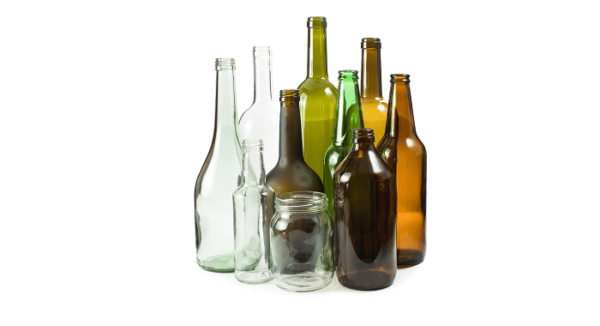
Find the location of a particular element. clear glass containers is located at coordinates (256, 97), (217, 166), (253, 226), (308, 247).